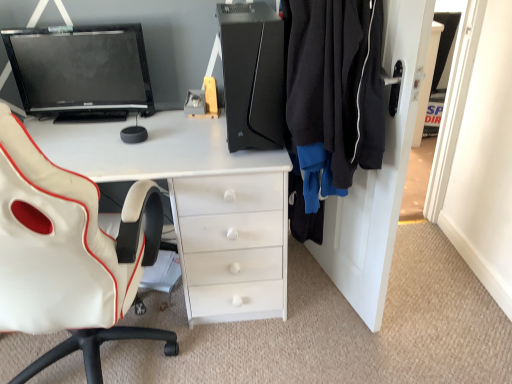
Image resolution: width=512 pixels, height=384 pixels. I want to click on vacant space situated above white glossy desk at center (from a real-world perspective), so click(x=134, y=138).